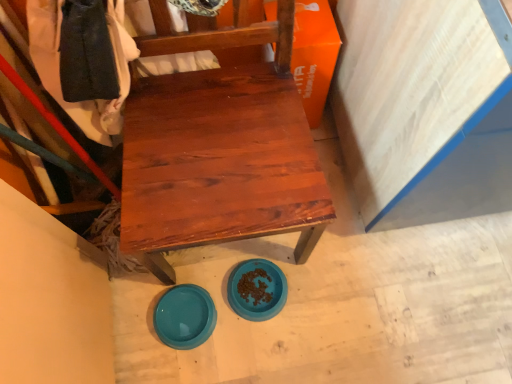
Locate an element on the screen. Image resolution: width=512 pixels, height=384 pixels. free spot below teal glossy plate at lower center, arranged as the 1th plate when viewed from the left (from a real-world perspective) is located at coordinates (185, 319).